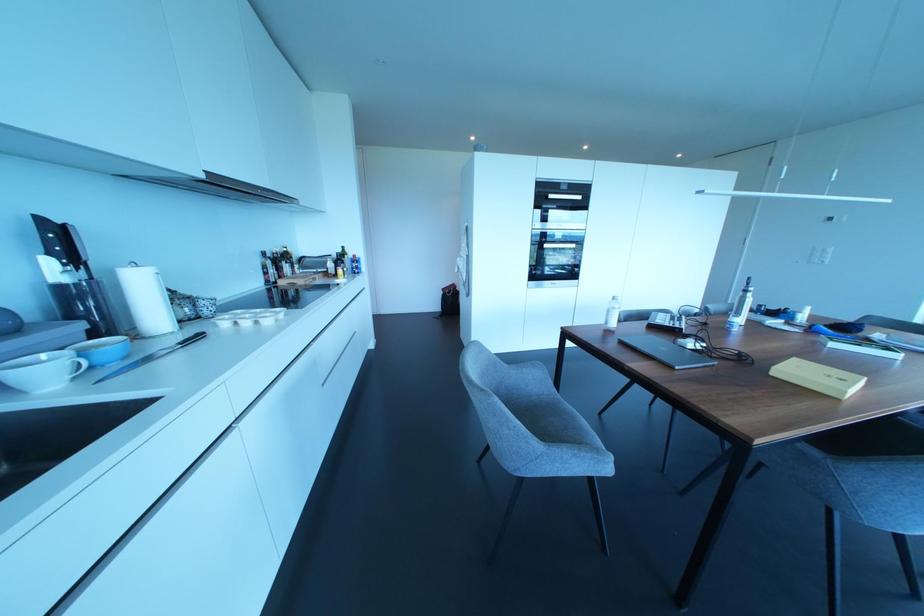
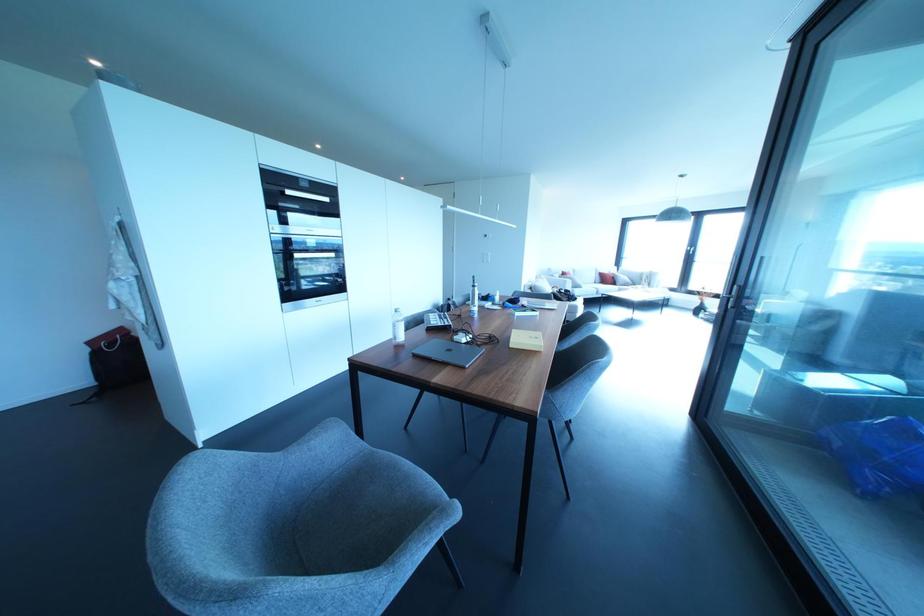
The point at (613, 323) is marked in the first image. Where is the corresponding point in the second image?

(400, 337)